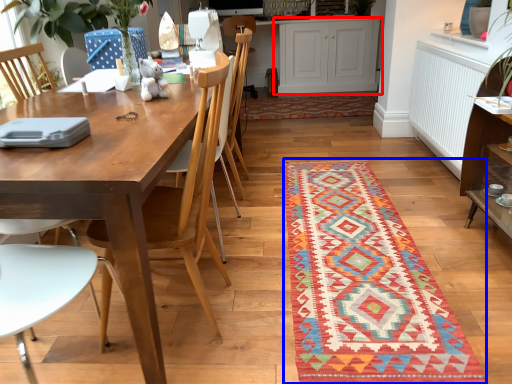
Question: Which of the following is the closest to the observer, cabinetry (highlighted by a red box) or mat (highlighted by a blue box)?

Choices:
 (A) cabinetry
 (B) mat

Answer: (B)